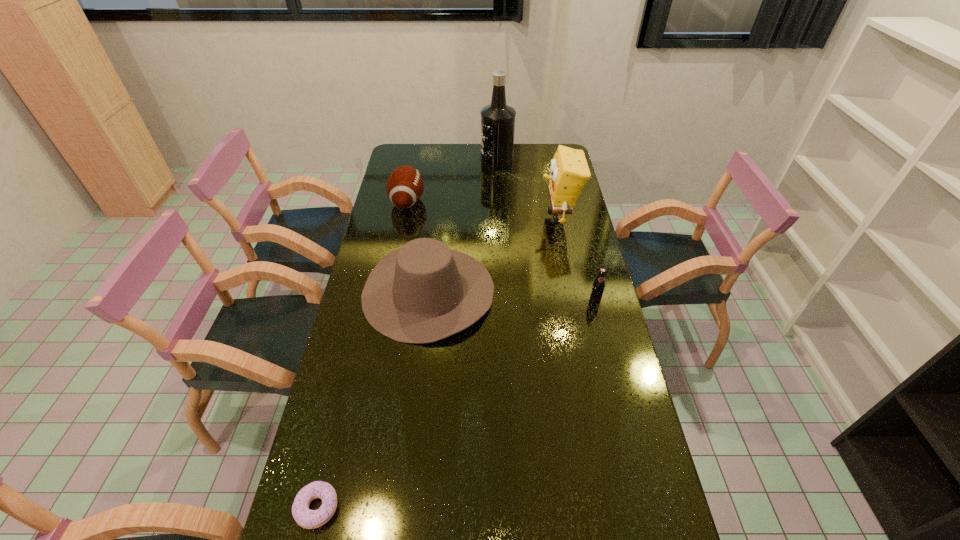
This screenshot has width=960, height=540. I want to click on vacant space situated on the front label of the tallest object, so tap(441, 160).

Where is `vacant space located 0.310m on the face of the sponge`? The height and width of the screenshot is (540, 960). vacant space located 0.310m on the face of the sponge is located at coordinates (462, 217).

Find the location of a particular element. This screenshot has width=960, height=540. vacant space positioned on the face of the sponge is located at coordinates (507, 217).

The width and height of the screenshot is (960, 540). I want to click on free space located 0.230m on the face of the sponge, so click(482, 217).

Where is `free point located 0.270m on the right of the cowboy hat`? This screenshot has width=960, height=540. free point located 0.270m on the right of the cowboy hat is located at coordinates (574, 292).

The width and height of the screenshot is (960, 540). In order to click on vacant space located on the laces of the football in this screenshot , I will do `click(477, 201)`.

Locate an element on the screen. This screenshot has width=960, height=540. vacant point located 0.360m on the front label of the pop is located at coordinates (621, 402).

This screenshot has width=960, height=540. In order to click on free space located on the right of the doughnut in this screenshot , I will do `click(417, 508)`.

You are a GUI agent. You are given a task and a screenshot of the screen. Output one action in this format:
    pyautogui.click(x=<x>, y=<y>)
    Task: Click on the object at the far edge
    The width and height of the screenshot is (960, 540).
    Given the screenshot: What is the action you would take?
    pyautogui.click(x=497, y=119)

Image resolution: width=960 pixels, height=540 pixels. What are the coordinates of `cowboy hat that is at the left edge` in the screenshot? It's located at (423, 292).